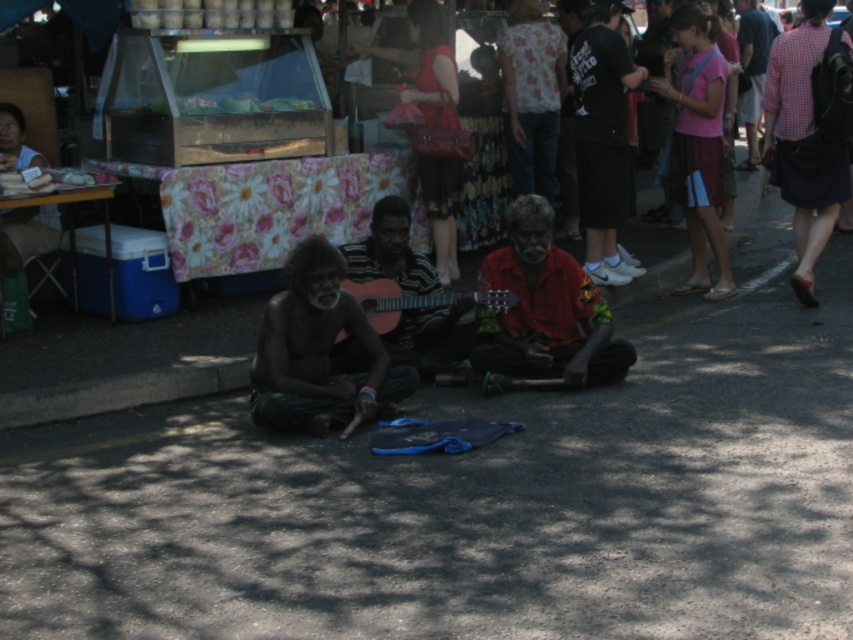
Which of these two, red matte shirt at center or wooden guitar at center, stands shorter?

With less height is wooden guitar at center.

Measure the distance from red matte shirt at center to wooden guitar at center.

21.16 inches

Who is more distant from viewer, [543,346] or [399,268]?

Point [399,268]

Locate an element on the screen. red matte shirt at center is located at coordinates (544, 308).

Is matte black man at center to the right of pink fabric skirt at right from the viewer's perspective?

Indeed, matte black man at center is positioned on the right side of pink fabric skirt at right.

Where is `matte black man at center`? The image size is (853, 640). matte black man at center is located at coordinates (804, 141).

Identify the location of matte black man at center. The height and width of the screenshot is (640, 853). (804, 141).

What are the coordinates of `matte black man at center` in the screenshot? It's located at (804, 141).

Which is in front, point (492, 256) or point (697, 189)?

Point (492, 256) is in front.

In the scene shown: Is red matte shirt at center positioned in front of pink fabric skirt at right?

Yes, red matte shirt at center is closer to the viewer.

Identify the location of red matte shirt at center. The height and width of the screenshot is (640, 853). (544, 308).